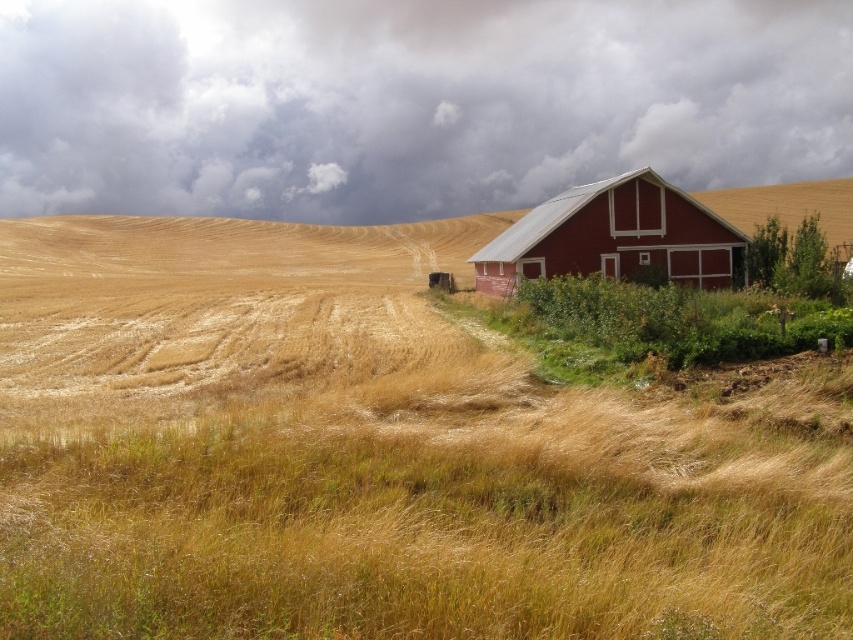
You are a farmer standing in the field looking towards the barn. You notice the dry grass at lower center and the dark gray cloud at upper center. Which object is closer to the ground?

The dry grass at lower center is closer to the ground because it is positioned under the dark gray cloud at upper center.